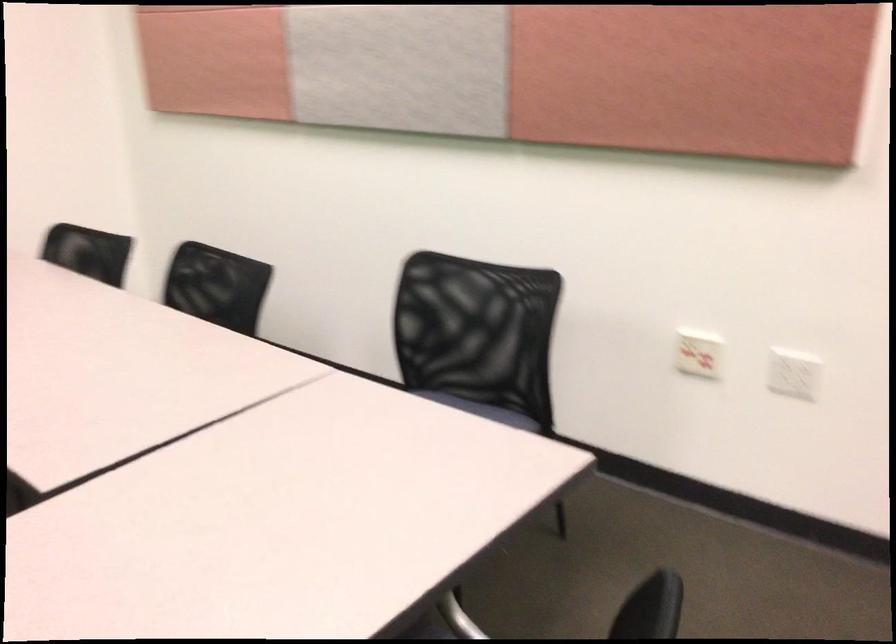
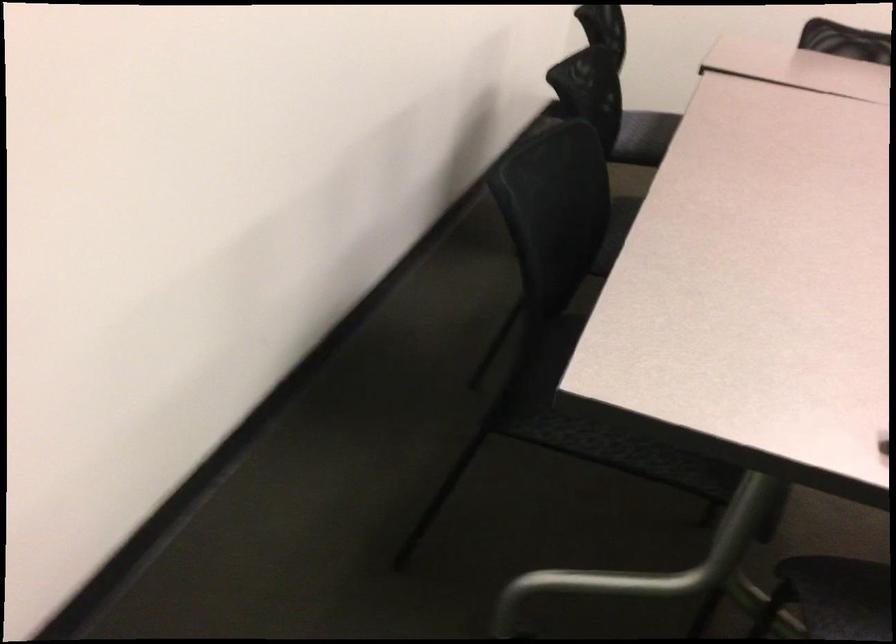
Question: Which direction would the cameraman need to move to produce the second image? Reply with the corresponding letter.

Choices:
 (A) Left
 (B) Right
 (C) Forward
 (D) Backward

Answer: (A)